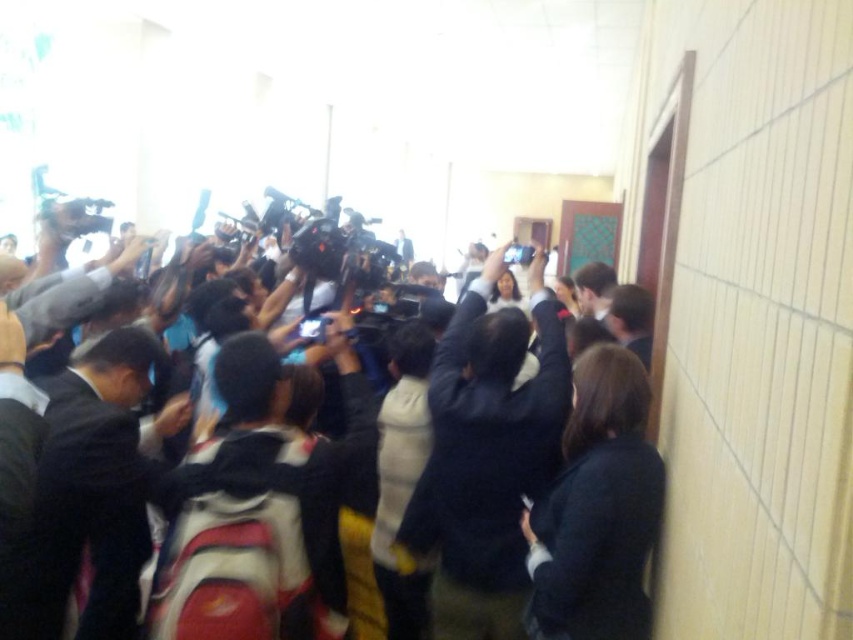
You are a photographer trying to capture a clear shot of the white cotton jacket at center. However, the black fabric crowd at center is obstructing your view. Can you move around to get a better angle without stepping into restricted areas?

The black fabric crowd at center is behind the white cotton jacket at center, so you can move around to the front of the white cotton jacket at center to get an unobstructed view.